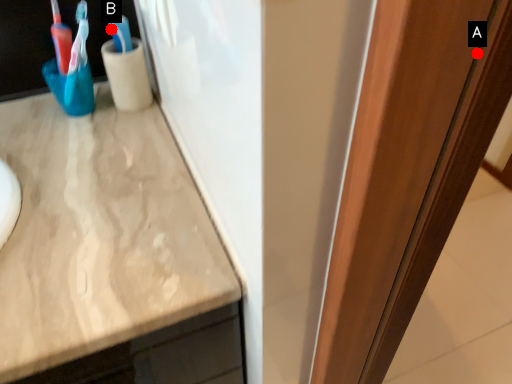
Question: Two points are circled on the image, labeled by A and B beside each circle. Which point is closer to the camera taking this photo?

Choices:
 (A) A is closer
 (B) B is closer

Answer: (A)